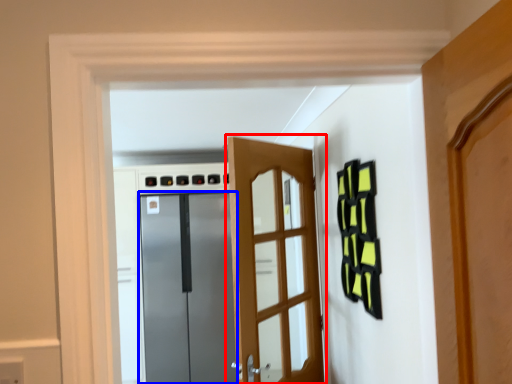
Question: Which object appears closest to the camera in this image, door (highlighted by a red box) or door (highlighted by a blue box)?

Choices:
 (A) door
 (B) door

Answer: (A)